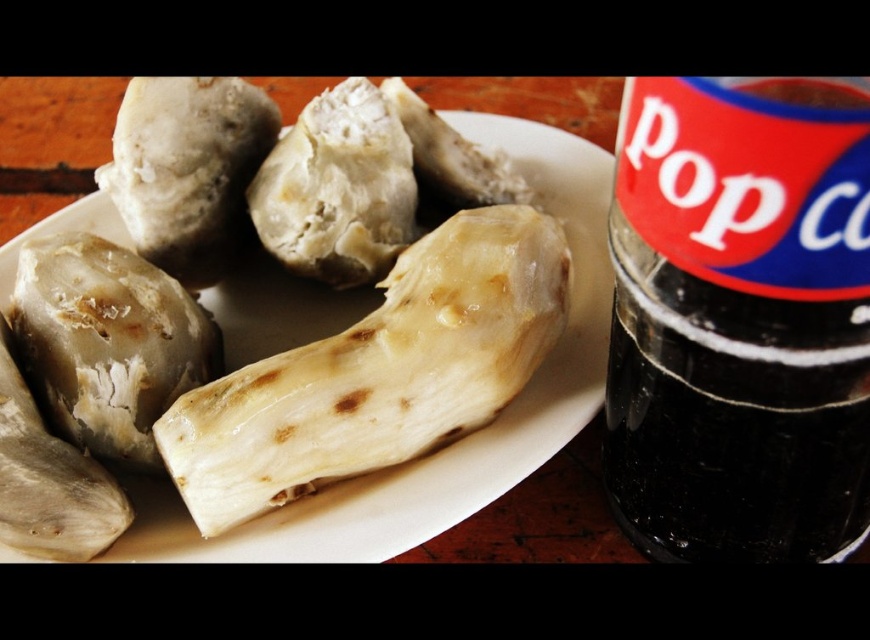
Question: Can you confirm if black glass bottle at right is thinner than white matte plate at center?

Choices:
 (A) no
 (B) yes

Answer: (B)

Question: From the image, what is the correct spatial relationship of black glass bottle at right in relation to white matte food at center?

Choices:
 (A) below
 (B) above

Answer: (A)

Question: Estimate the real-world distances between objects in this image. Which object is closer to the black glass bottle at right?

Choices:
 (A) white matte/soft food at center-left
 (B) white matte food at center
 (C) white matte plate at center

Answer: (C)

Question: Does black glass bottle at right come behind white matte/soft food at center-left?

Choices:
 (A) yes
 (B) no

Answer: (B)

Question: Considering the real-world distances, which object is farthest from the white matte food at center?

Choices:
 (A) white matte plate at center
 (B) black glass bottle at right
 (C) white matte food at center-left
 (D) white matte/soft food at center-left

Answer: (B)

Question: Which of the following is the farthest from the observer?

Choices:
 (A) white matte plate at center
 (B) black glass bottle at right

Answer: (A)